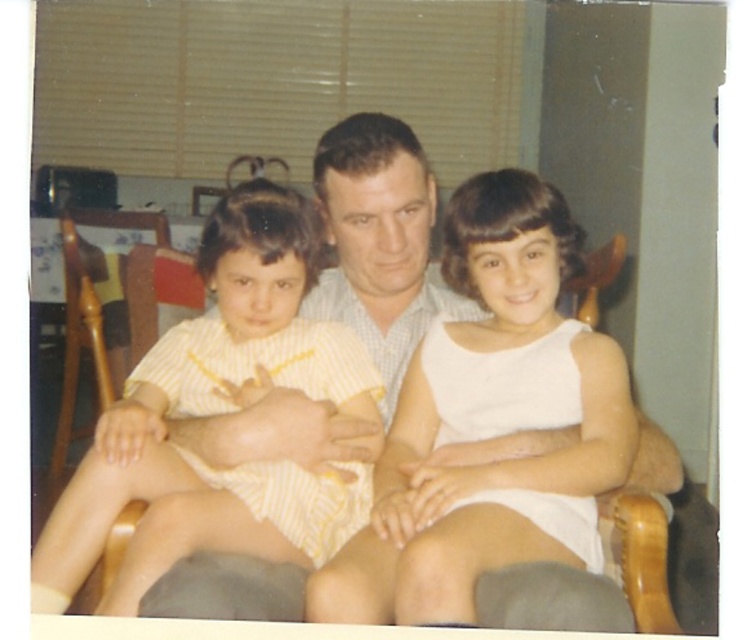
Who is lower down, yellow striped fabric at left or wooden rocking chair at left?

yellow striped fabric at left

At what (x,y) coordinates should I click in order to perform the action: click on yellow striped fabric at left. Please return your answer as a coordinate pair (x, y). Looking at the image, I should click on (215, 412).

Where is `yellow striped fabric at left`? The image size is (743, 640). yellow striped fabric at left is located at coordinates (215, 412).

Is white satin dress at center closer to the viewer compared to white fabric dress at center?

Yes, it is in front of white fabric dress at center.

Is white satin dress at center wider than white fabric dress at center?

No.

Which is behind, point (484, 486) or point (186, 422)?

Point (186, 422)

Identify the location of white satin dress at center. The height and width of the screenshot is (640, 743). click(489, 422).

Based on the photo, between white satin dress at center and wooden rocking chair at left, which one is positioned lower?

white satin dress at center

Is white satin dress at center further to camera compared to wooden rocking chair at left?

No, it is not.

Is point (432, 353) less distant than point (158, 234)?

Yes, point (432, 353) is closer to viewer.

The width and height of the screenshot is (743, 640). Find the location of `white satin dress at center`. white satin dress at center is located at coordinates (489, 422).